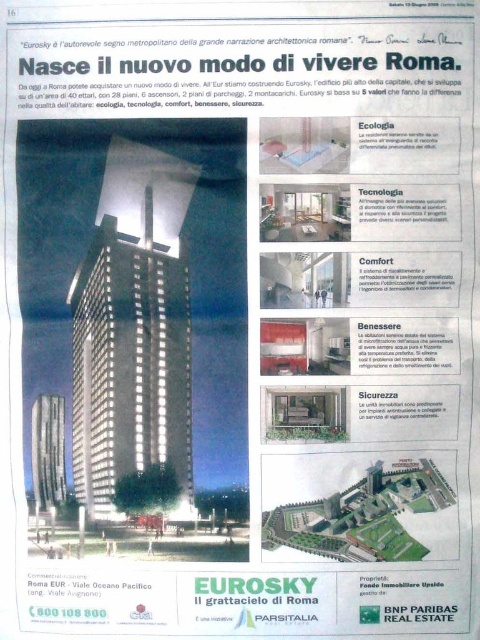
You are a city planner reviewing this advertisement for a new building project in Rome. The advertisement features two towers, a matte glass skyscraper at center and a silver metallic tower at center. Which of the two towers is taller?

The matte glass skyscraper at center is much taller than the silver metallic tower at center, so the matte glass skyscraper at center is the taller one.

From the picture: You are designing a new building in Rome and want to ensure it aligns with the existing architectural narrative highlighted in the Euroska advertisement. Based on the provided scene, where is the matte glass skyscraper at center positioned relative to the page layout?

The matte glass skyscraper at center is located at point (133, 332), which places it centrally on the page, aligning with the advertisement emphasizing its role as the authoritative metropolitan sign of Rome.

You are a city planner reviewing the Euroska project. The city has a regulation that no building can be wider than the existing historical structures. Given that the silver metallic tower at center is a historical structure, does the matte glass skyscraper at center comply with the width regulation?

The matte glass skyscraper at center is wider than the silver metallic tower at center, so it does not comply with the regulation since it exceeds the width of the historical structure.